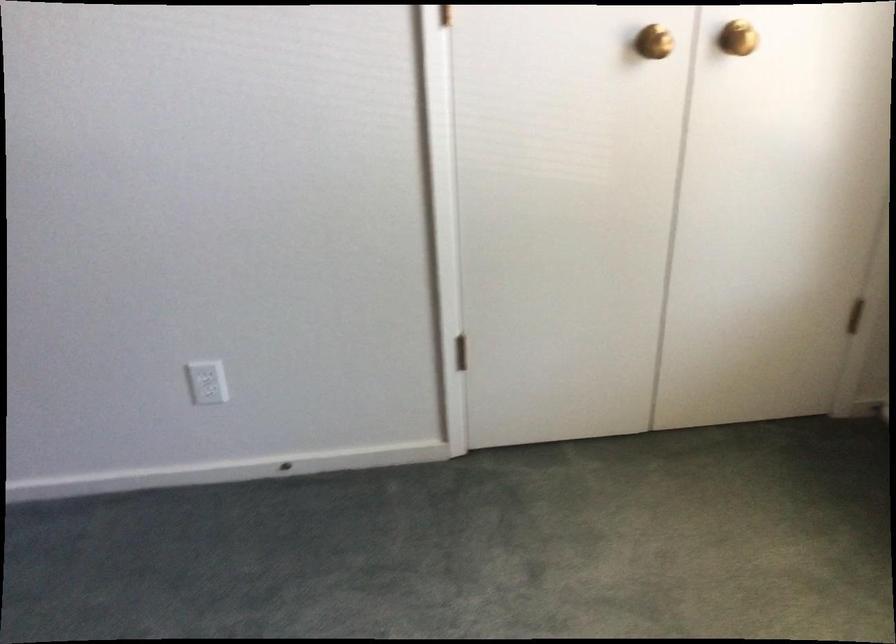
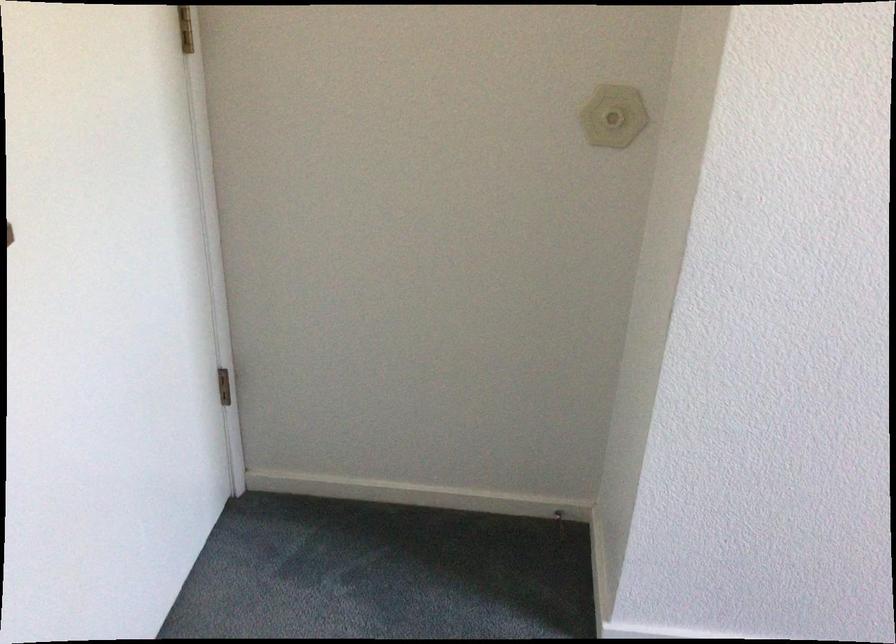
Question: In a continuous first-person perspective shot, in which direction is the camera moving?

Choices:
 (A) Left
 (B) Right
 (C) Forward
 (D) Backward

Answer: (A)